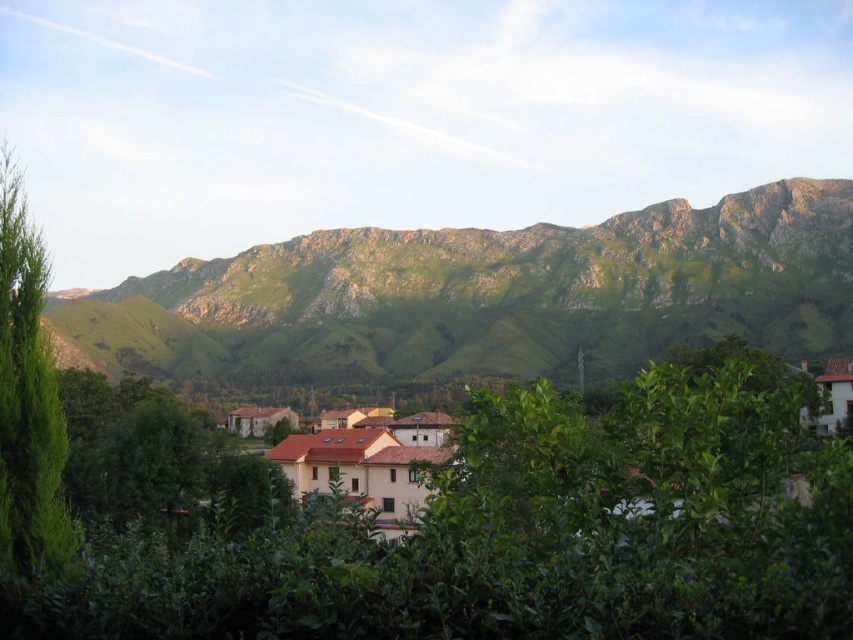
You are standing at point A at the bottom left corner of the image. There is a point B at point (10,534). You want to walk to point B. The path is straight. The distance between you and point B is 148.67 feet. If you walk at a speed of 3 feet per second, how many seconds will it take you to reach point B?

The distance between point A at the bottom left corner and point B at point (10,534) is 148.67 feet. Walking at 3 feet per second, it will take 148.67 divided by 3, which is approximately 49.56 seconds. So, it will take about 50 seconds to reach point B.

You are a landscape photographer planning to capture the brown tiled houses at center and the green leafy tree at left in a single frame. Based on their sizes in the image, which object would appear smaller in the photo?

The green leafy tree at left appears smaller in the photo because its width is less than that of the brown tiled houses at center.